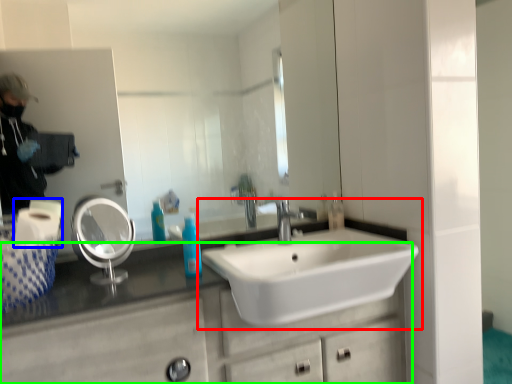
Question: Which object is the farthest from sink (highlighted by a red box)? Choose among these: toilet paper (highlighted by a blue box) or bathroom cabinet (highlighted by a green box).

Choices:
 (A) toilet paper
 (B) bathroom cabinet

Answer: (A)